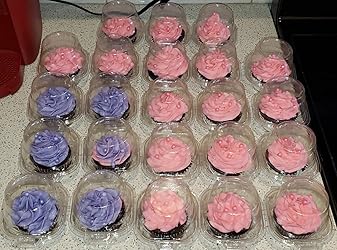
Identify the location of space between coffee maker and cupcake. This screenshot has height=250, width=337. (39, 48).